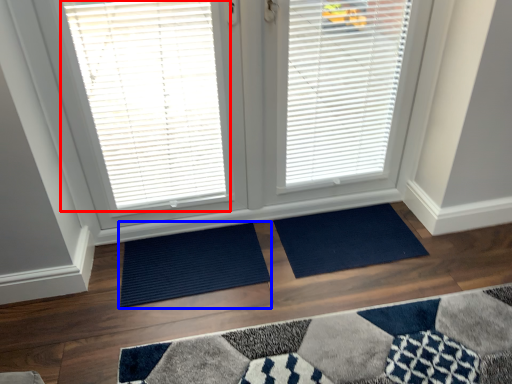
Question: Which of the following is the farthest to the observer, window blind (highlighted by a red box) or doormat (highlighted by a blue box)?

Choices:
 (A) window blind
 (B) doormat

Answer: (B)